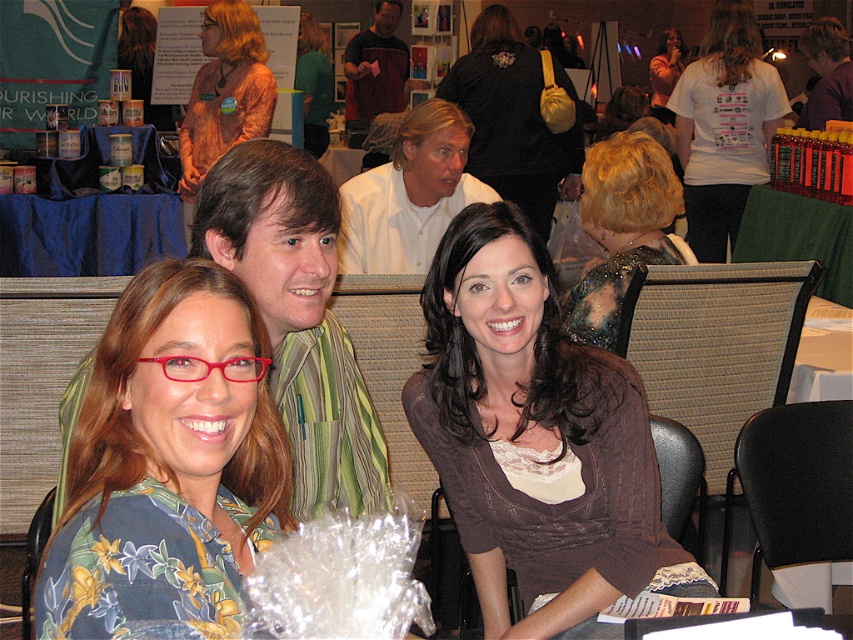
Is white button-down shirt at center closer to the viewer compared to wooden instrument at center?

Yes.

Is point (405, 124) closer to camera compared to point (357, 72)?

Yes, it is.

Does point (369, 234) come in front of point (358, 100)?

Yes, it is.

Image resolution: width=853 pixels, height=640 pixels. Find the location of `white button-down shirt at center`. white button-down shirt at center is located at coordinates (410, 193).

Between white matte t-shirt at upper right and green fabric shirt at upper center, which one has more height?

white matte t-shirt at upper right

Between white matte t-shirt at upper right and green fabric shirt at upper center, which one appears on the right side from the viewer's perspective?

white matte t-shirt at upper right is more to the right.

Does point (755, 77) come closer to viewer compared to point (308, 140)?

That is True.

Image resolution: width=853 pixels, height=640 pixels. I want to click on white matte t-shirt at upper right, so click(x=724, y=125).

Is point (547, 211) behind point (241, 97)?

Yes.

Is point (496, 186) positioned in front of point (219, 120)?

No.

Identify the location of matte black jacket at upper center. Image resolution: width=853 pixels, height=640 pixels. (x=514, y=118).